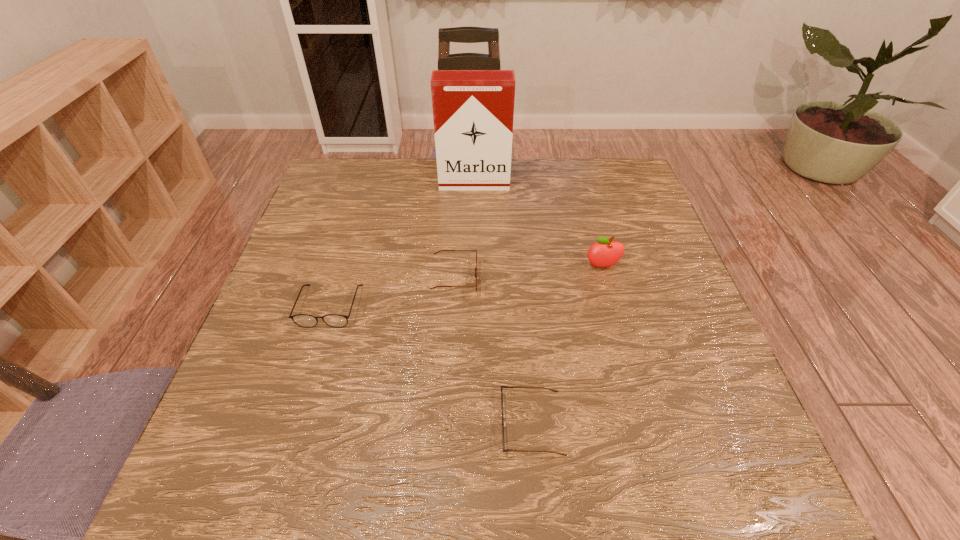
This screenshot has height=540, width=960. Find the location of `vacant region located 0.150m on the front-facing side of the leftmost spectacles`. vacant region located 0.150m on the front-facing side of the leftmost spectacles is located at coordinates (303, 391).

The width and height of the screenshot is (960, 540). Identify the location of free spot located at the front view of the second spectacles from left to right. (608, 279).

Locate an element on the screen. This screenshot has width=960, height=540. free space located on the front-facing side of the shortest spectacles is located at coordinates [x=342, y=423].

This screenshot has height=540, width=960. Identify the location of free region located 0.380m on the front-facing side of the shortest spectacles. [292, 423].

You are a GUI agent. You are given a task and a screenshot of the screen. Output one action in this format:
    pyautogui.click(x=<x>, y=<y>)
    Task: Click on the free space located 0.190m on the front-facing side of the shortest spectacles
    The height and width of the screenshot is (540, 960).
    Given the screenshot: What is the action you would take?
    pyautogui.click(x=396, y=423)

You are a GUI agent. You are given a task and a screenshot of the screen. Output one action in this format:
    pyautogui.click(x=<x>, y=<y>)
    Task: Click on the object present at the far edge
    Image resolution: width=960 pixels, height=540 pixels.
    Given the screenshot: What is the action you would take?
    pyautogui.click(x=473, y=110)

Locate an element on the screen. The image size is (960, 540). object that is at the near edge is located at coordinates (503, 423).

This screenshot has width=960, height=540. What are the coordinates of `object that is at the left edge` in the screenshot? It's located at (303, 320).

The width and height of the screenshot is (960, 540). I want to click on object located in the right edge section of the desktop, so click(605, 253).

Find the location of `vacant space at the far edge of the desktop`. vacant space at the far edge of the desktop is located at coordinates (399, 197).